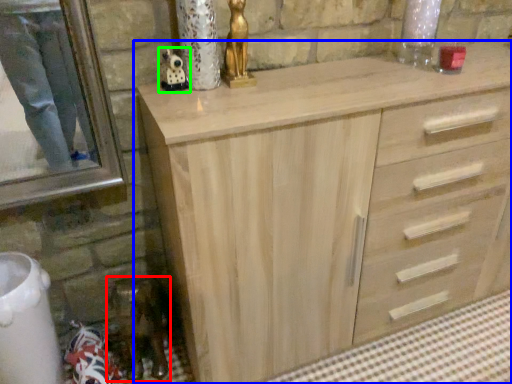
Question: Which object is the farthest from miniature (highlighted by a red box)? Choose among these: chest of drawers (highlighted by a blue box) or miniature (highlighted by a green box).

Choices:
 (A) chest of drawers
 (B) miniature

Answer: (B)